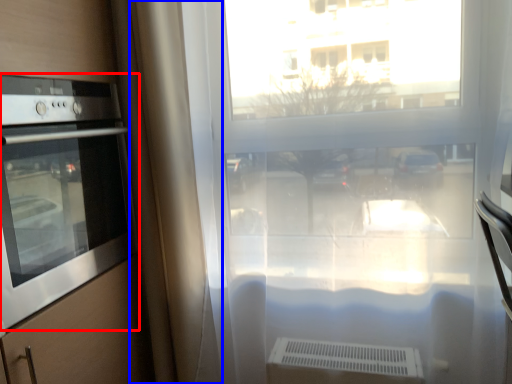
Question: Which object appears closest to the camera in this image, home appliance (highlighted by a red box) or curtain (highlighted by a blue box)?

Choices:
 (A) home appliance
 (B) curtain

Answer: (A)